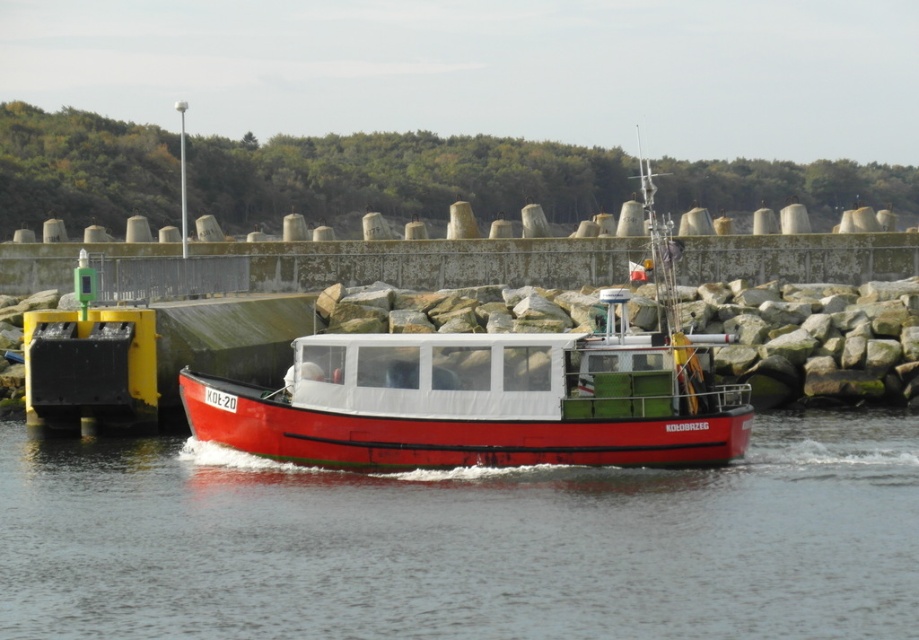
You are a sailor on the matte red boat at center. You notice the smooth water at boat right. In which direction relative to your boat is the smooth water located?

The smooth water at boat right is located to the left of the matte red boat at center.

You are standing on the boat KOE20 and looking towards the breakwater. There is a point marked at coordinates (x=464, y=541). What is located at that point?

At point (x=464, y=541) lies smooth water at boat right.